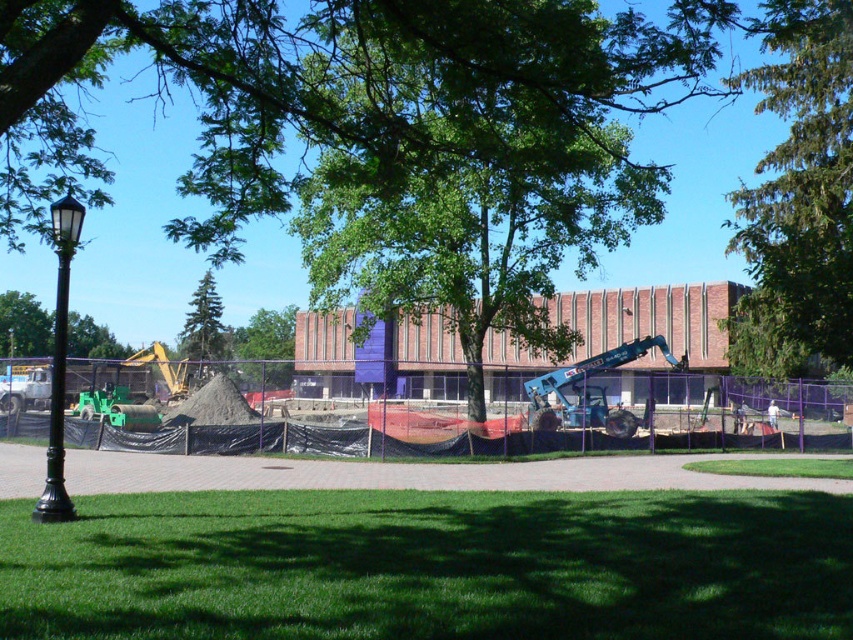
Between green grass at lower left and green leafy tree at center, which one appears on the left side from the viewer's perspective?

green leafy tree at center

Where is `green grass at lower left`? green grass at lower left is located at coordinates (432, 564).

Who is positioned more to the left, blue metallic excavator at center or green leafy tree at center?

green leafy tree at center is more to the left.

Which is in front, point (653, 340) or point (252, 314)?

Point (653, 340) is in front.

Between point (561, 371) and point (238, 332), which one is positioned in front?

Point (561, 371) is in front.

The width and height of the screenshot is (853, 640). I want to click on blue metallic excavator at center, so click(x=589, y=392).

Which is behind, point (605, 410) or point (718, 474)?

The point (605, 410) is behind.

Based on the photo, is blue metallic excavator at center closer to camera compared to green grass at lower center?

No, blue metallic excavator at center is further to the viewer.

Image resolution: width=853 pixels, height=640 pixels. Identify the location of blue metallic excavator at center. (589, 392).